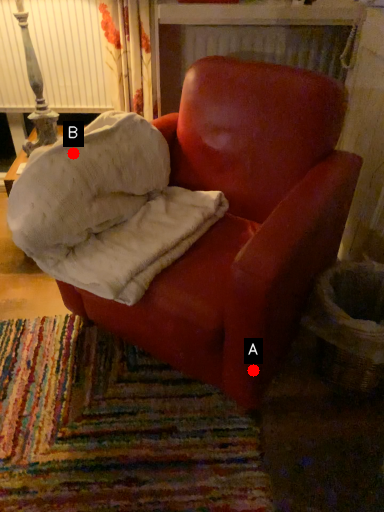
Question: Two points are circled on the image, labeled by A and B beside each circle. Which point appears closest to the camera in this image?

Choices:
 (A) A is closer
 (B) B is closer

Answer: (A)